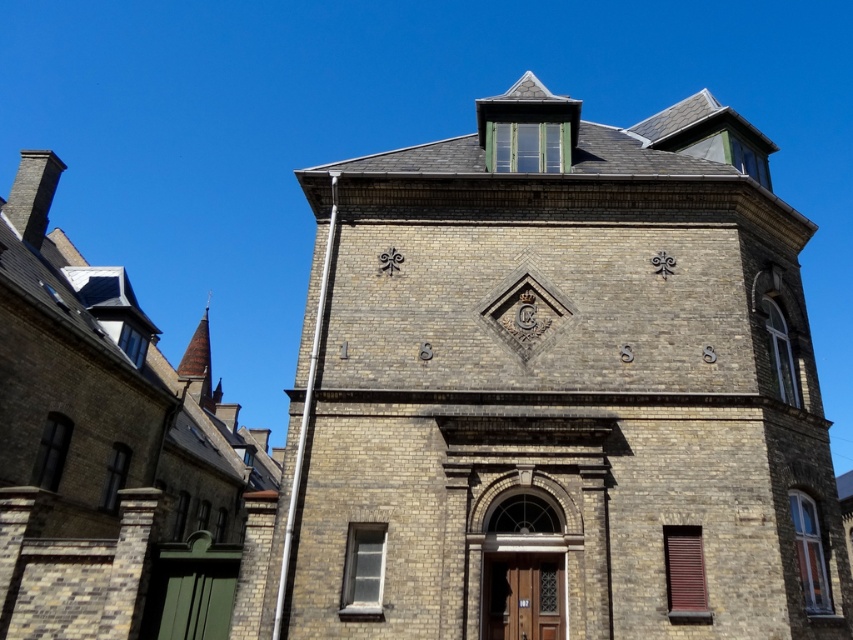
You are standing in front of the two buildings. The brown brick tower at center and the brown brick church at left. Which one is located higher up in the image?

The brown brick tower at center is positioned over the brown brick church at left, so it is higher up in the image.

You are standing in front of the two story building and want to take a photo of the brown brick tower at center and the smooth copper spire at upper left. Which object will appear larger in the photo?

The brown brick tower at center will appear larger in the photo because it is in front of the smooth copper spire at upper left, making it closer to the camera.

Looking at this image, you are a construction worker planning to install a new fence between the brown brick tower at center and the brown brick church at left. The fence requires a minimum of 60 feet of space between the two structures to be installed safely. Based on the provided information, will the current distance allow for the fence installation?

The distance between the brown brick tower at center and the brown brick church at left is 59.75 feet, which is less than the required 60 feet. Therefore, the fence cannot be installed safely with the current spacing.